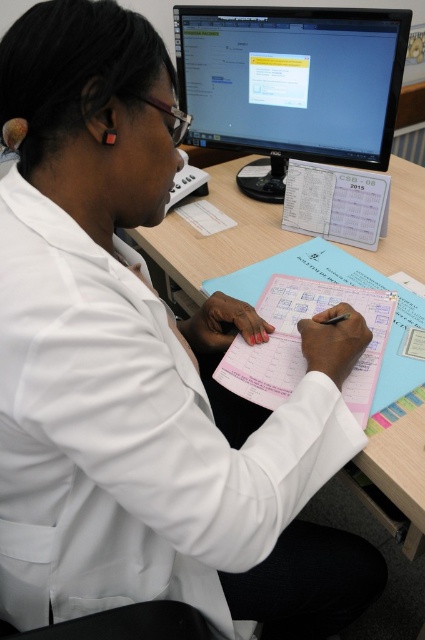
From the picture: Between matte black monitor at upper center and blue paper at center, which one has more height?

blue paper at center is taller.

Does matte black monitor at upper center come in front of blue paper at center?

That is True.

Which is in front, point (402, 58) or point (173, 269)?

Point (402, 58) is more forward.

What are the coordinates of `matte black monitor at upper center` in the screenshot? It's located at (291, 84).

Is blue paper at center to the left of pink paper at center from the viewer's perspective?

No, blue paper at center is not to the left of pink paper at center.

Does blue paper at center appear on the right side of pink paper at center?

Correct, you'll find blue paper at center to the right of pink paper at center.

Locate an element on the screen. This screenshot has height=640, width=425. blue paper at center is located at coordinates (215, 236).

The image size is (425, 640). What are the coordinates of `blue paper at center` in the screenshot? It's located at (215, 236).

Between matte black monitor at upper center and pink paper at center, which one is positioned higher?

matte black monitor at upper center is higher up.

Who is taller, matte black monitor at upper center or pink paper at center?

matte black monitor at upper center is taller.

Image resolution: width=425 pixels, height=640 pixels. What do you see at coordinates (291, 84) in the screenshot?
I see `matte black monitor at upper center` at bounding box center [291, 84].

Identify the location of matte black monitor at upper center. This screenshot has width=425, height=640. (291, 84).